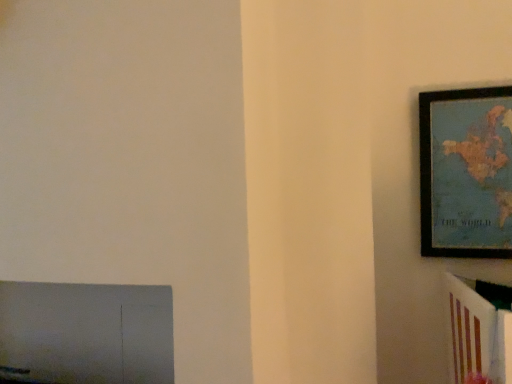
Question: Is white glossy bookshelf at right smaller than wooden framed map at upper right?

Choices:
 (A) no
 (B) yes

Answer: (B)

Question: From the image's perspective, is white glossy bookshelf at right on top of wooden framed map at upper right?

Choices:
 (A) no
 (B) yes

Answer: (A)

Question: From the image's perspective, does white glossy bookshelf at right appear lower than wooden framed map at upper right?

Choices:
 (A) yes
 (B) no

Answer: (A)

Question: Is white glossy bookshelf at right aimed at wooden framed map at upper right?

Choices:
 (A) no
 (B) yes

Answer: (A)

Question: Is white glossy bookshelf at right looking in the opposite direction of wooden framed map at upper right?

Choices:
 (A) yes
 (B) no

Answer: (B)

Question: Considering the relative sizes of white glossy bookshelf at right and wooden framed map at upper right in the image provided, is white glossy bookshelf at right thinner than wooden framed map at upper right?

Choices:
 (A) no
 (B) yes

Answer: (A)

Question: Is the position of wooden framed map at upper right more distant than that of white glossy bookshelf at right?

Choices:
 (A) no
 (B) yes

Answer: (B)

Question: Is wooden framed map at upper right positioned with its back to white glossy bookshelf at right?

Choices:
 (A) yes
 (B) no

Answer: (B)

Question: Does wooden framed map at upper right have a larger size compared to white glossy bookshelf at right?

Choices:
 (A) yes
 (B) no

Answer: (A)

Question: From a real-world perspective, is wooden framed map at upper right located higher than white glossy bookshelf at right?

Choices:
 (A) yes
 (B) no

Answer: (A)

Question: Are wooden framed map at upper right and white glossy bookshelf at right located far from each other?

Choices:
 (A) yes
 (B) no

Answer: (B)

Question: Is wooden framed map at upper right smaller than white glossy bookshelf at right?

Choices:
 (A) no
 (B) yes

Answer: (A)

Question: From a real-world perspective, relative to white glossy bookshelf at right, is wooden framed map at upper right vertically above or below?

Choices:
 (A) above
 (B) below

Answer: (A)